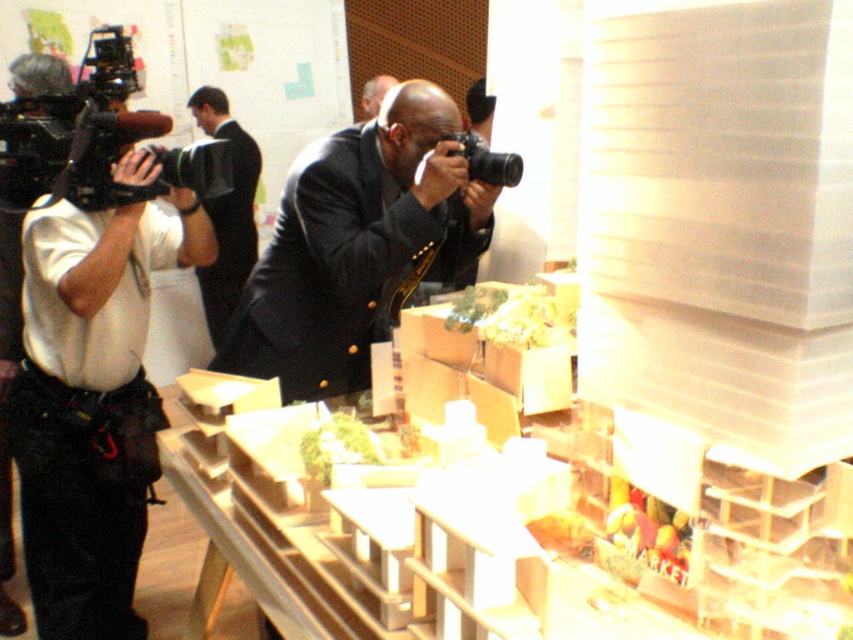
Does dark gray suit at center appear on the left side of black plastic camera at center?

Indeed, dark gray suit at center is positioned on the left side of black plastic camera at center.

Which is above, dark gray suit at center or black plastic camera at center?

black plastic camera at center is above.

The image size is (853, 640). I want to click on dark gray suit at center, so click(357, 244).

You are a GUI agent. You are given a task and a screenshot of the screen. Output one action in this format:
    pyautogui.click(x=<x>, y=<y>)
    Task: Click on the dark gray suit at center
    The image size is (853, 640).
    Given the screenshot: What is the action you would take?
    pyautogui.click(x=357, y=244)

Which is above, white shirt at left or black plastic video camera at upper left?

black plastic video camera at upper left

Is the position of white shirt at left less distant than that of black plastic video camera at upper left?

Yes, it is.

Is point (45, 497) in front of point (112, 28)?

Yes, point (45, 497) is in front of point (112, 28).

At what (x,y) coordinates should I click in order to perform the action: click on white shirt at left. Please return your answer as a coordinate pair (x, y). Looking at the image, I should click on (94, 397).

Consider the image. Does dark gray suit at center come behind green leafy vegetable at center?

Yes, dark gray suit at center is behind green leafy vegetable at center.

Does dark gray suit at center lie in front of green leafy vegetable at center?

No, it is behind green leafy vegetable at center.

Measure the distance between dark gray suit at center and camera.

dark gray suit at center and camera are 5.65 feet apart.

You are a GUI agent. You are given a task and a screenshot of the screen. Output one action in this format:
    pyautogui.click(x=<x>, y=<y>)
    Task: Click on the dark gray suit at center
    Image resolution: width=853 pixels, height=640 pixels.
    Given the screenshot: What is the action you would take?
    pyautogui.click(x=357, y=244)